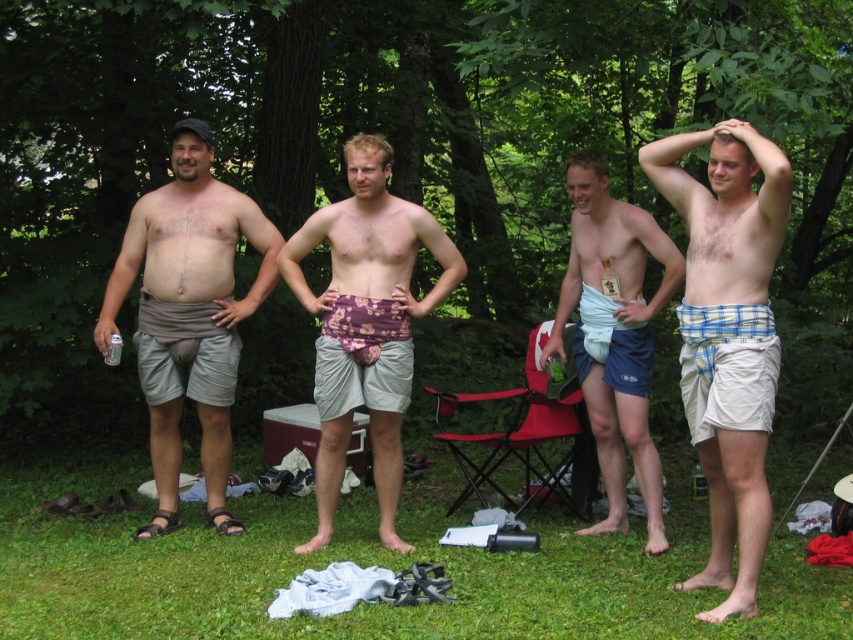
Which is behind, point (669, 282) or point (386, 161)?

The point (669, 282) is behind.

Is white fabric towel at center below blonde hair at center?

Indeed, white fabric towel at center is positioned under blonde hair at center.

Who is more distant from viewer, (567, 161) or (379, 157)?

Positioned behind is point (567, 161).

This screenshot has height=640, width=853. What are the coordinates of `white fabric towel at center` in the screenshot? It's located at (614, 333).

Which of these two, white fabric towel at center or matte black cap at upper left, stands taller?

white fabric towel at center

Between white fabric towel at center and matte black cap at upper left, which one appears on the left side from the viewer's perspective?

Positioned to the left is matte black cap at upper left.

Is point (670, 272) behind point (199, 179)?

That is False.

The image size is (853, 640). Identify the location of white fabric towel at center. (614, 333).

Is point (608, 196) farther from viewer compared to point (357, 141)?

That is True.

Which is above, smooth white hair at center or blonde hair at center?

blonde hair at center is above.

Does point (590, 195) come farther from viewer compared to point (369, 138)?

Yes, point (590, 195) is behind point (369, 138).

Locate an element on the screen. This screenshot has height=640, width=853. smooth white hair at center is located at coordinates (589, 182).